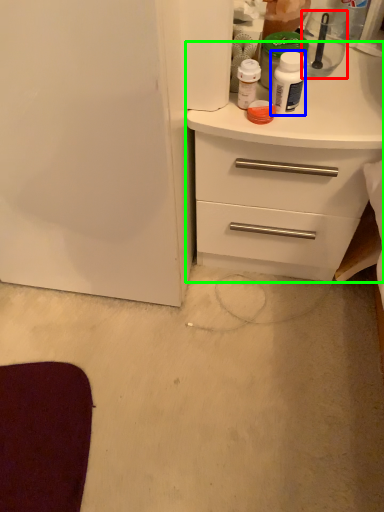
Question: Which object is positioned farthest from appliance (highlighted by a red box)? Select from bottle (highlighted by a blue box) and chest of drawers (highlighted by a green box).

Choices:
 (A) bottle
 (B) chest of drawers

Answer: (B)